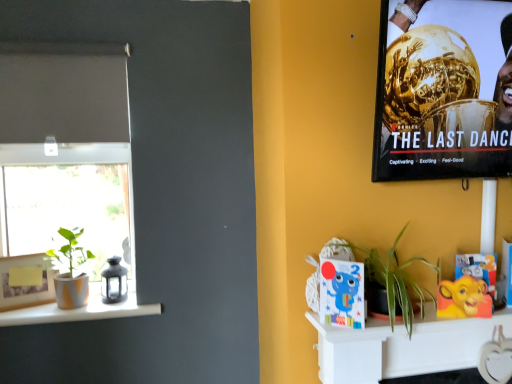
Question: Should I look upward or downward to see green leafy plant at center-right, which is the first houseplant in right-to-left order?

Choices:
 (A) up
 (B) down

Answer: (B)

Question: Is matte orange vase at left bigger than metallic gold trophy at upper right?

Choices:
 (A) no
 (B) yes

Answer: (A)

Question: Is matte orange vase at left oriented towards metallic gold trophy at upper right?

Choices:
 (A) no
 (B) yes

Answer: (A)

Question: Considering the relative sizes of matte orange vase at left and metallic gold trophy at upper right in the image provided, is matte orange vase at left taller than metallic gold trophy at upper right?

Choices:
 (A) no
 (B) yes

Answer: (A)

Question: Can you confirm if matte orange vase at left is thinner than metallic gold trophy at upper right?

Choices:
 (A) yes
 (B) no

Answer: (B)

Question: Is matte orange vase at left further to camera compared to metallic gold trophy at upper right?

Choices:
 (A) yes
 (B) no

Answer: (A)

Question: Is metallic gold trophy at upper right at the back of matte orange vase at left?

Choices:
 (A) yes
 (B) no

Answer: (B)

Question: Is green leafy plant at center-right, which is the first houseplant in right-to-left order, positioned with its back to green matte plant at left, the first houseplant viewed from the back?

Choices:
 (A) no
 (B) yes

Answer: (A)

Question: From the image's perspective, is green leafy plant at center-right, marked as the second houseplant in a left-to-right arrangement, located above green matte plant at left, the first houseplant viewed from the back?

Choices:
 (A) no
 (B) yes

Answer: (B)

Question: Can we say green leafy plant at center-right, the first houseplant in the front-to-back sequence, lies outside green matte plant at left, which is the 1th houseplant from left to right?

Choices:
 (A) no
 (B) yes

Answer: (B)

Question: Does green leafy plant at center-right, the first houseplant in the front-to-back sequence, appear on the right side of green matte plant at left, which appears as the 2th houseplant when viewed from the front?

Choices:
 (A) no
 (B) yes

Answer: (B)

Question: Is green leafy plant at center-right, which is the first houseplant in right-to-left order, to the left of green matte plant at left, which appears as the 2th houseplant when viewed from the front, from the viewer's perspective?

Choices:
 (A) yes
 (B) no

Answer: (B)

Question: Can you confirm if green leafy plant at center-right, the first houseplant in the front-to-back sequence, is taller than green matte plant at left, which is counted as the 2th houseplant, starting from the right?

Choices:
 (A) no
 (B) yes

Answer: (A)

Question: Is metallic gold trophy at upper right smaller than white matte shelf at lower right?

Choices:
 (A) no
 (B) yes

Answer: (A)